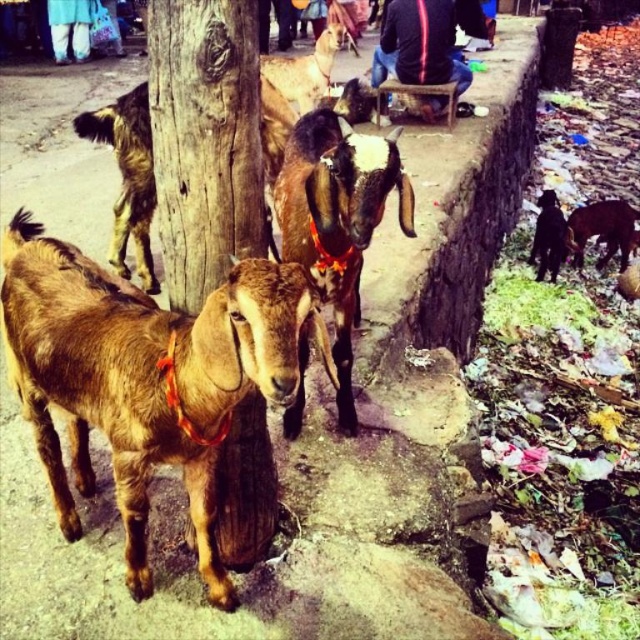
You are a photographer trying to capture a clear photo of the brown rough fur goat at right. However, the brown rough tree trunk at left is blocking your view. Can you adjust your position to avoid the tree trunk and still see the goat?

The brown rough tree trunk at left is in front of the brown rough fur goat at right, so moving to the side might allow you to see around the tree trunk and still capture the goat in the photo.

You are a farmer who wants to feed a brown woolen goat at center. The feed bucket is placed 1.2 meters away from the goat. Can the goat reach the bucket if its rope is 1.2 meters long?

The brown woolen goat at center is 1.23 meters away from the feed bucket. Since the rope is 1.2 meters long, the goat cannot reach the bucket as the distance is slightly longer than the rope.